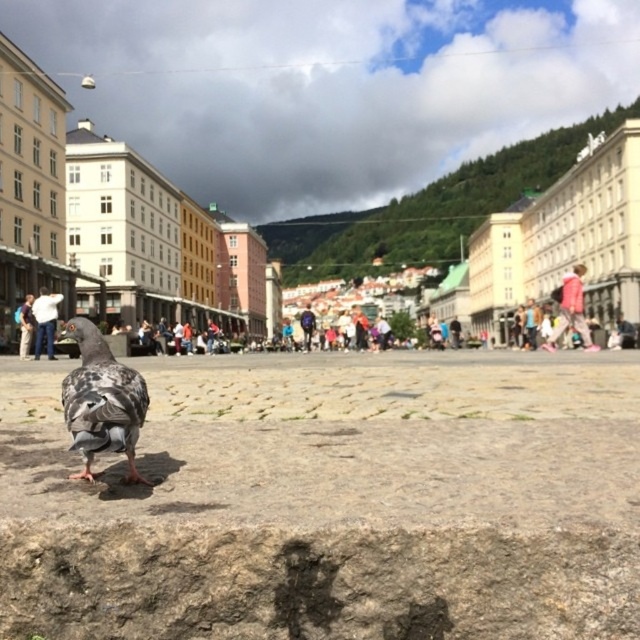
You are a photographer standing at the center of the square, aiming to capture a photo that includes both the pink fabric at upper right and the white cotton shirt at center. Given that your camera has a maximum zoom range of 50 meters, will you be able to fit both objects into the same frame without moving closer?

The distance between the pink fabric at upper right and the white cotton shirt at center is 74.16 meters, which exceeds the camera maximum zoom range of 50 meters. Therefore, you cannot fit both objects into the same frame without moving closer.

You are a photographer standing in the urban square scene. You want to capture a photo where both the pink fabric at upper right and the white cotton shirt at center are visible. Which object should you frame first to ensure both are in the shot?

The pink fabric at upper right is wider than the white cotton shirt at center, so you should frame the pink fabric at upper right first to ensure both objects fit in the photo.

You are a photographer standing in the urban square scene. You notice a person wearing a white cotton shirt at center and dark blue jeans at center. Which piece of clothing is taller when viewed from your position?

The white cotton shirt at center is taller than the dark blue jeans at center.